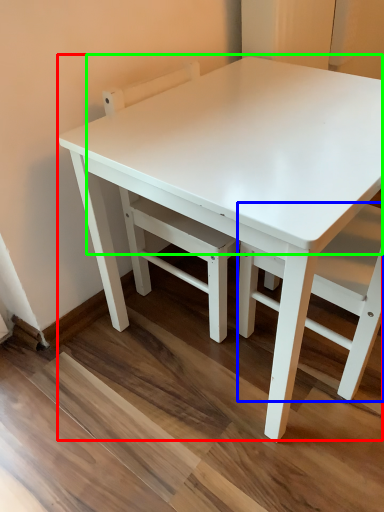
Question: Estimate the real-world distances between objects in this image. Which object is farther from table (highlighted by a red box), chair (highlighted by a blue box) or table top (highlighted by a green box)?

Choices:
 (A) chair
 (B) table top

Answer: (A)